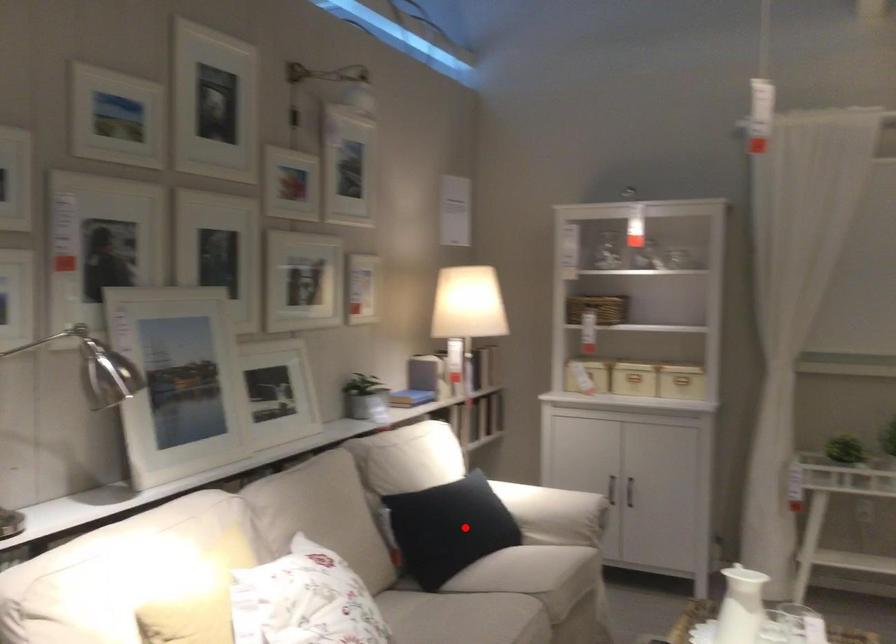
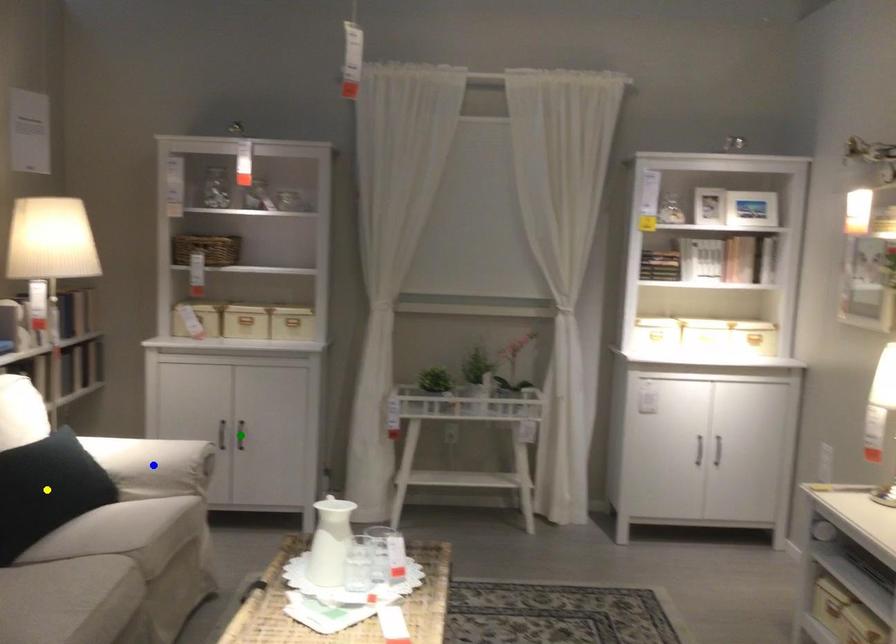
Question: I am providing you with two images of the same scene from different viewpoints. A red point is marked on the first image. You are given multiple points on the second image. Which point in image 2 represents the same 3d spot as the red point in image 1?

Choices:
 (A) blue point
 (B) green point
 (C) yellow point

Answer: (C)